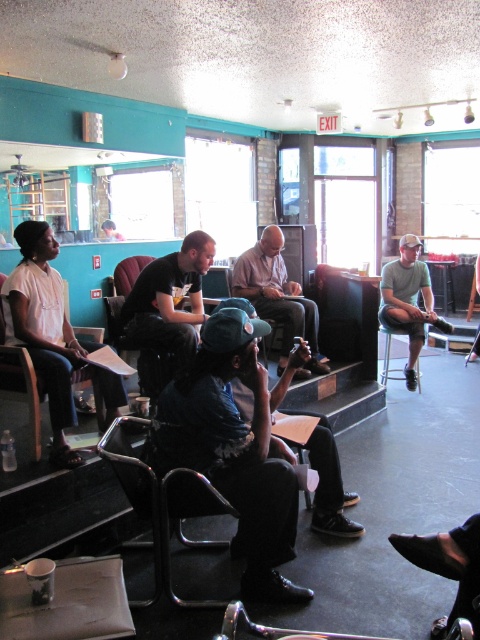
Is black metal chair at center thinner than metallic silver chair at left?

Indeed, black metal chair at center has a lesser width compared to metallic silver chair at left.

Between black metal chair at center and metallic silver chair at left, which one is positioned higher?

Positioned higher is metallic silver chair at left.

The width and height of the screenshot is (480, 640). I want to click on black metal chair at center, so click(154, 500).

Where is `black metal chair at center`? This screenshot has height=640, width=480. black metal chair at center is located at coordinates (154, 500).

Which is in front, point (146, 282) or point (117, 436)?

Point (117, 436) is more forward.

Describe the element at coordinates (167, 312) in the screenshot. The height and width of the screenshot is (640, 480). I see `black matte shirt at center` at that location.

Which is in front, point (152, 284) or point (228, 502)?

Positioned in front is point (228, 502).

Where is `black matte shirt at center`? black matte shirt at center is located at coordinates (167, 312).

Can you confirm if gray cotton t-shirt at center is bigger than metallic stool at center?

No.

Is gray cotton t-shirt at center smaller than metallic stool at center?

Yes.

Which is behind, point (400, 292) or point (393, 378)?

Positioned behind is point (393, 378).

Where is `gray cotton t-shirt at center`? This screenshot has height=640, width=480. gray cotton t-shirt at center is located at coordinates (408, 300).